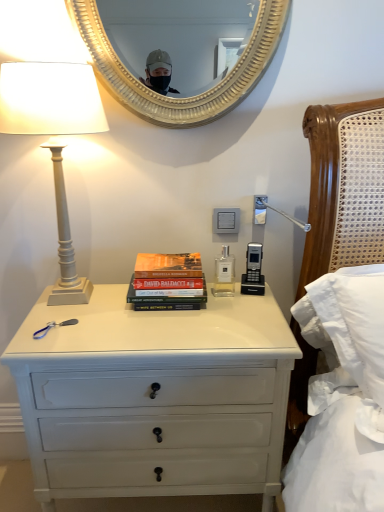
Where is `free location in front of white matte column lamp at left`? This screenshot has height=512, width=384. free location in front of white matte column lamp at left is located at coordinates (77, 337).